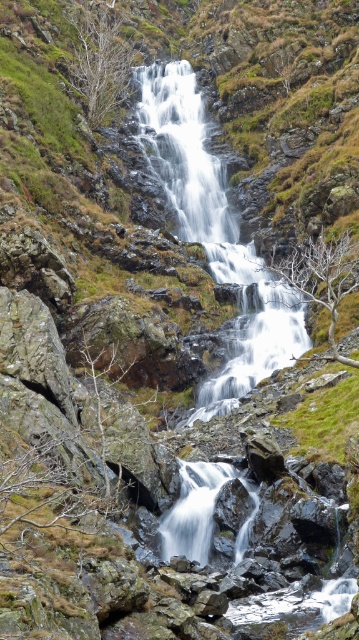
You are a hiker who wants to cross the waterfall area. You see the white frothy water at center and the white smooth water at center. Which one is farther from you?

The distance between the white frothy water at center and the white smooth water at center is 30.34 meters, so the white smooth water at center is farther away from you.

You are standing at the base of the waterfall and want to reach a hidden cave entrance. The path to the cave requires you to navigate around two points marked on the terrain. The first point is at coordinate point (240,326), and the second is at point (207,509). Which point should you approach first if you want to reach the cave entrance that is located behind both points?

You should approach point (207,509) first because point (240,326) is behind it. Since the cave entrance is behind both points, you need to go around point (207,509) first to access the area behind it, which also includes the location of point (240,326).

You are a hiker who wants to cross the waterfall area safely. You notice two types of water in the image. Which one should you avoid stepping into, the white frothy water at center or the white smooth water at center?

You should avoid stepping into the white frothy water at center because it is above the white smooth water at center, indicating it has a stronger current and is more dangerous.